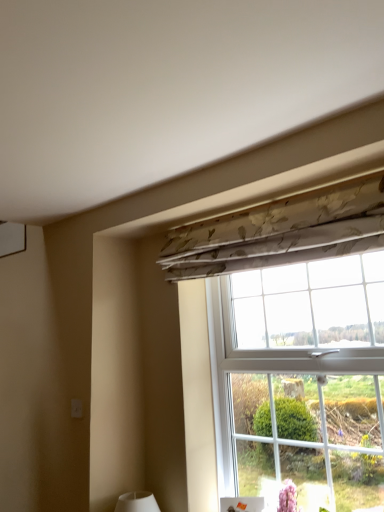
Question: Does point (380, 245) appear closer or farther from the camera than point (195, 273)?

Choices:
 (A) farther
 (B) closer

Answer: (B)

Question: Is floral fabric at upper center taller or shorter than floral fabric curtain at upper center?

Choices:
 (A) short
 (B) tall

Answer: (B)

Question: Is floral fabric at upper center bigger or smaller than floral fabric curtain at upper center?

Choices:
 (A) small
 (B) big

Answer: (B)

Question: Is point (193, 230) positioned closer to the camera than point (253, 310)?

Choices:
 (A) farther
 (B) closer

Answer: (B)

Question: Is floral fabric curtain at upper center spatially inside floral fabric at upper center, or outside of it?

Choices:
 (A) outside
 (B) inside

Answer: (A)

Question: In terms of height, does floral fabric curtain at upper center look taller or shorter compared to floral fabric at upper center?

Choices:
 (A) tall
 (B) short

Answer: (B)

Question: In terms of size, does floral fabric curtain at upper center appear bigger or smaller than floral fabric at upper center?

Choices:
 (A) big
 (B) small

Answer: (B)